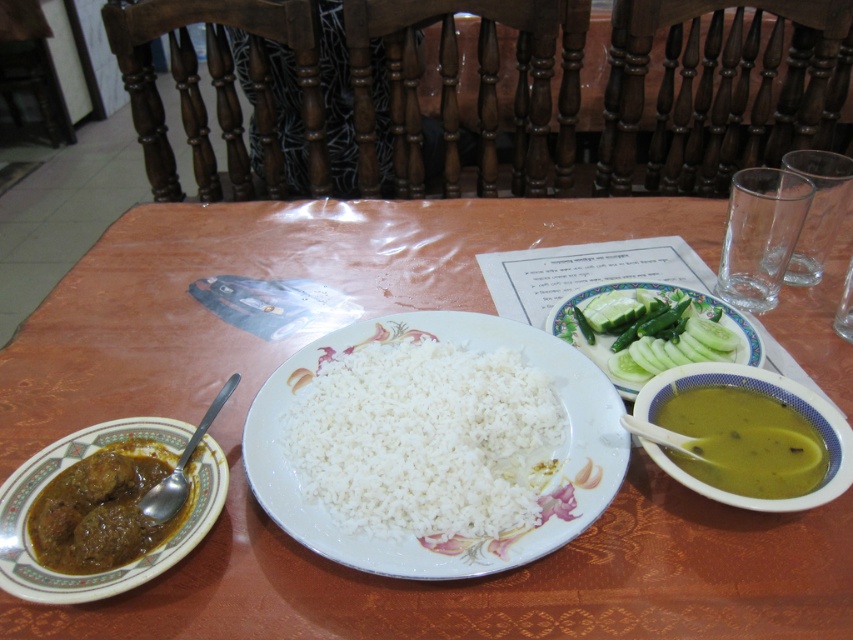
Which is above, sliced green cucumber at center right or green creamy soup at right?

sliced green cucumber at center right

From the picture: Does sliced green cucumber at center right appear on the right side of green creamy soup at right?

In fact, sliced green cucumber at center right is to the left of green creamy soup at right.

Between point (650, 321) and point (735, 428), which one is positioned in front?

Point (735, 428) is more forward.

Locate an element on the screen. The height and width of the screenshot is (640, 853). sliced green cucumber at center right is located at coordinates (x=653, y=330).

Is white polished rice at center further to camera compared to green creamy soup at right?

No, it is in front of green creamy soup at right.

Looking at this image, who is more distant from viewer, [405,387] or [735,424]?

The point [405,387] is behind.

Image resolution: width=853 pixels, height=640 pixels. What are the coordinates of `white polished rice at center` in the screenshot? It's located at (426, 440).

Can you confirm if brown wooden table at center is positioned below brown glossy curry at left?

No, brown wooden table at center is not below brown glossy curry at left.

The image size is (853, 640). Find the location of `brown wooden table at center`. brown wooden table at center is located at coordinates (368, 316).